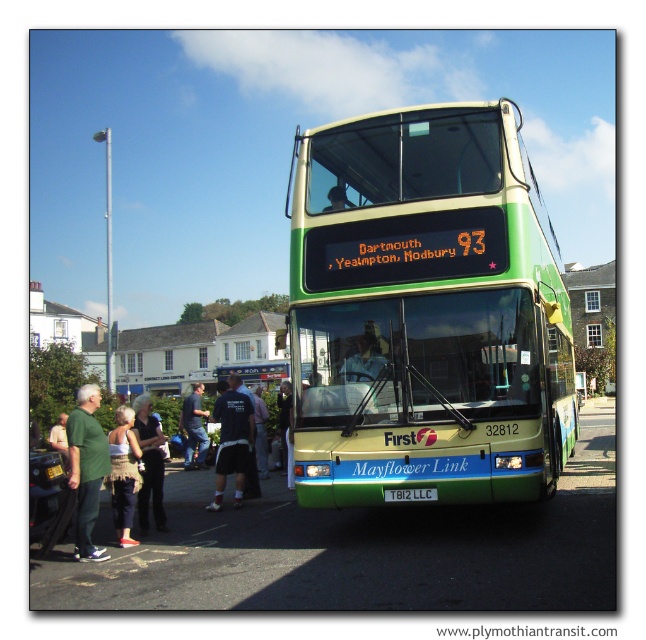
Is dark blue jersey at center shorter than white plastic license plate at center?

In fact, dark blue jersey at center may be taller than white plastic license plate at center.

Who is more distant from viewer, (x=233, y=444) or (x=410, y=497)?

Point (x=233, y=444)

I want to click on dark blue jersey at center, so click(x=231, y=440).

Who is more forward, (238, 408) or (183, 406)?

Positioned in front is point (238, 408).

Who is more distant from viewer, (242, 468) or (198, 436)?

The point (198, 436) is behind.

This screenshot has height=640, width=646. In order to click on dark blue jersey at center in this screenshot , I will do `click(231, 440)`.

From the picture: Who is higher up, green matte/deck bus at center or white plastic license plate at center?

green matte/deck bus at center is higher up.

In the scene shown: Who is more forward, [472,404] or [401,492]?

Point [472,404] is more forward.

Between point (468, 472) and point (430, 496), which one is positioned in front?

Point (468, 472) is more forward.

This screenshot has width=646, height=640. In order to click on green matte/deck bus at center in this screenshot , I will do `click(424, 312)`.